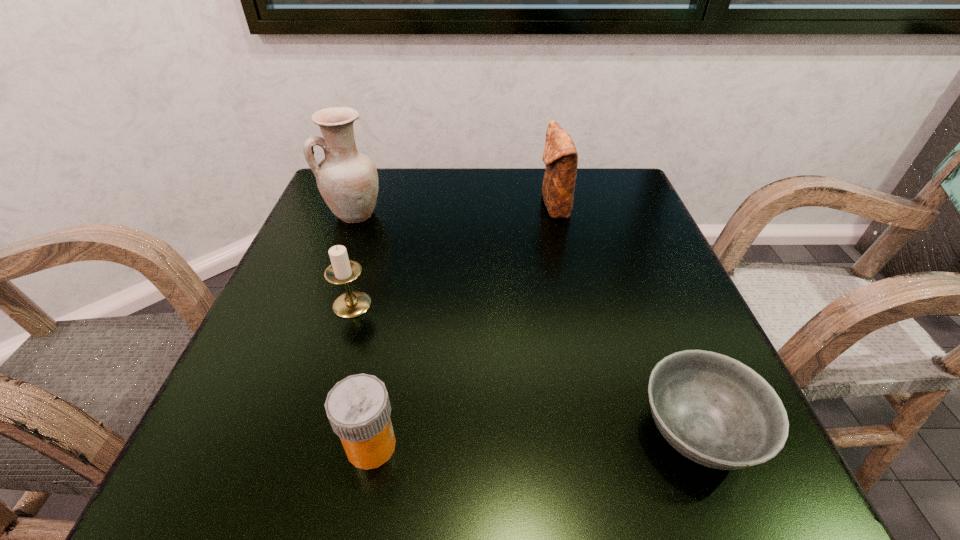
Where is `free space located 0.360m on the open side of the clutch bag`? The width and height of the screenshot is (960, 540). free space located 0.360m on the open side of the clutch bag is located at coordinates (384, 206).

Where is `free space located 0.300m on the open side of the clutch bag`? free space located 0.300m on the open side of the clutch bag is located at coordinates (410, 206).

Find the location of `vacant area located 0.130m on the open side of the clutch bag`. vacant area located 0.130m on the open side of the clutch bag is located at coordinates (483, 206).

Identify the location of vacant space located on the back of the candle holder. (387, 188).

Identify the location of free location located on the label side of the medicine. (510, 446).

Find the location of a particular element. The image size is (960, 540). free space located on the left of the shortest object is located at coordinates pos(520,432).

I want to click on pottery present at the far edge, so click(x=347, y=180).

You are a GUI agent. You are given a task and a screenshot of the screen. Output one action in this format:
    pyautogui.click(x=<x>, y=<y>)
    Task: Click on the clutch bag located at the far edge
    
    Given the screenshot: What is the action you would take?
    560,156

Find the location of a particular element. The height and width of the screenshot is (540, 960). medicine located in the near edge section of the desktop is located at coordinates (358, 408).

The height and width of the screenshot is (540, 960). I want to click on bowl at the near edge, so click(716, 411).